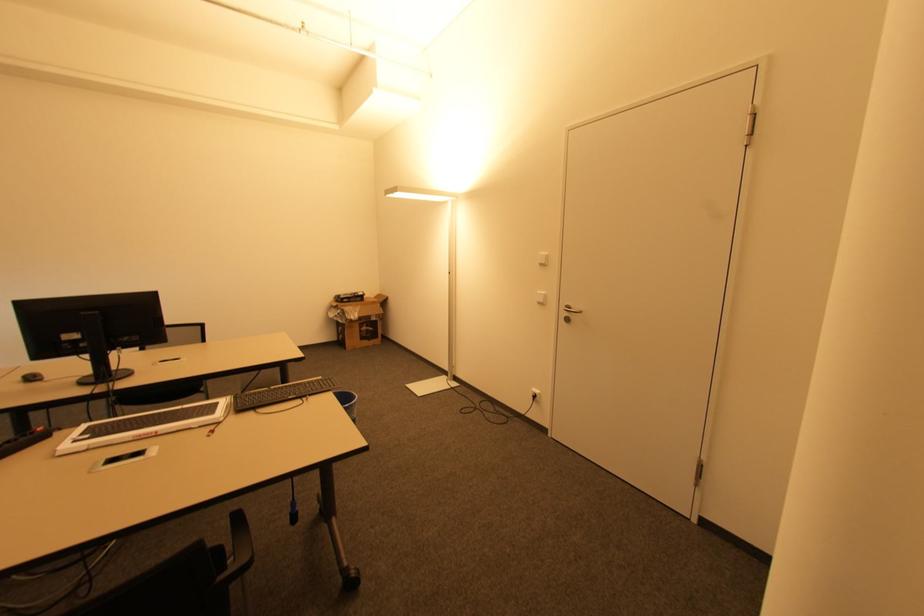
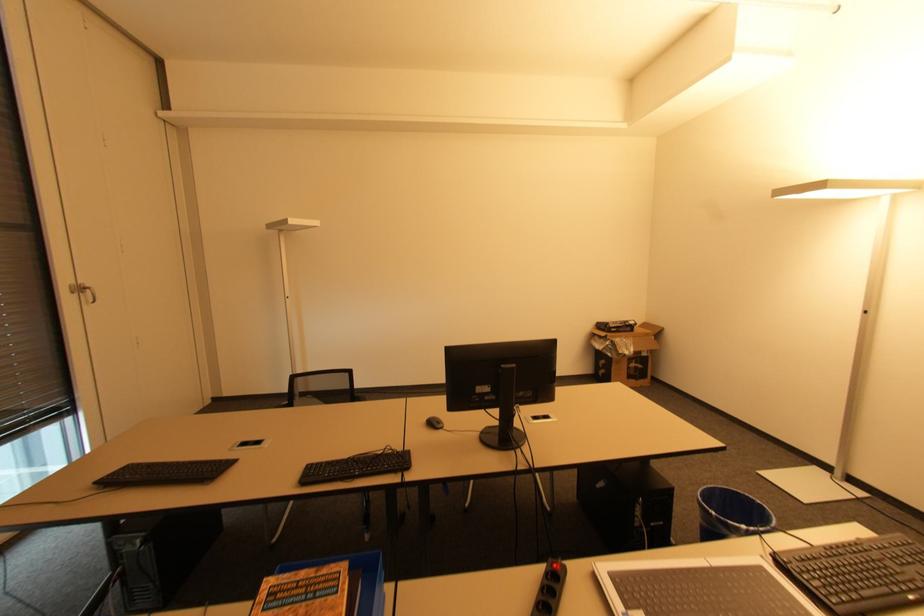
Question: Which direction would the cameraman need to move to produce the second image? Reply with the corresponding letter.

Choices:
 (A) Left
 (B) Right
 (C) Forward
 (D) Backward

Answer: (A)